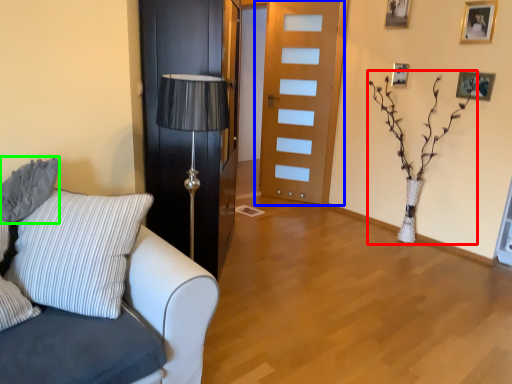
Question: Which object is the closest to the plant (highlighted by a red box)? Choose among these: door (highlighted by a blue box) or pillow (highlighted by a green box).

Choices:
 (A) door
 (B) pillow

Answer: (A)